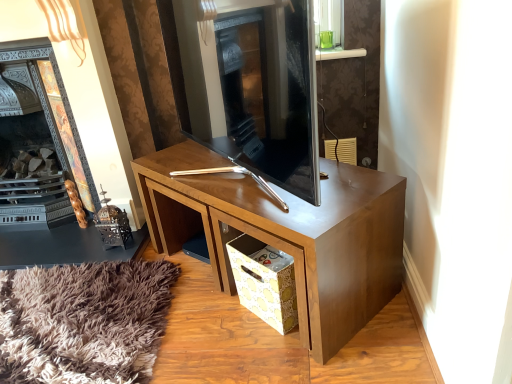
Locate an element on the screen. vacant space that's between wooden desk at center and yellow paper bag at lower center is located at coordinates (224, 305).